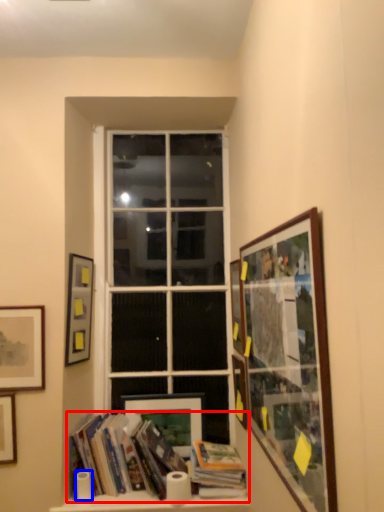
Question: Which object appears closest to the camera in this image, book (highlighted by a red box) or toilet paper (highlighted by a blue box)?

Choices:
 (A) book
 (B) toilet paper

Answer: (A)